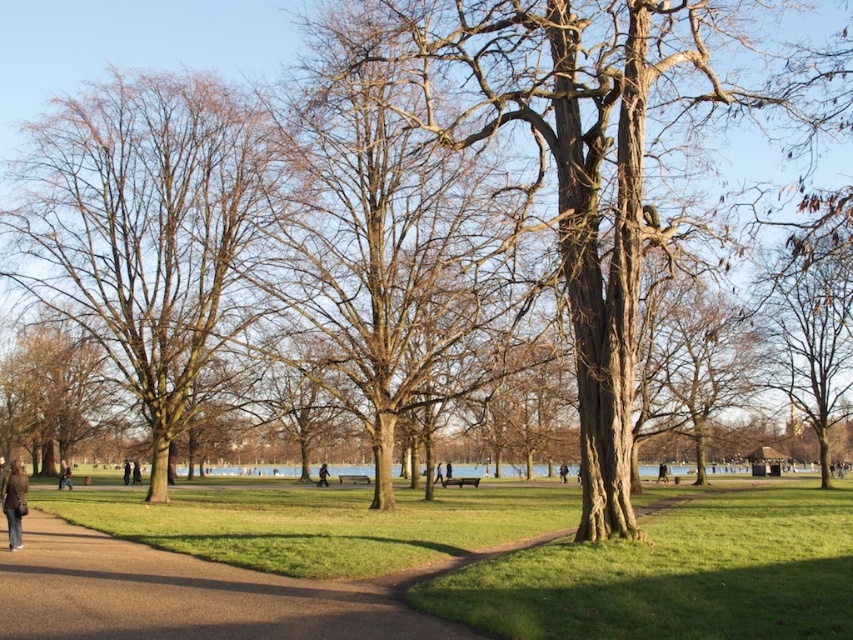
Question: Can you confirm if bare wood tree at left is wider than brown rough tree at left?

Choices:
 (A) no
 (B) yes

Answer: (A)

Question: Among these points, which one is nearest to the camera?

Choices:
 (A) (318, 467)
 (B) (801, 300)

Answer: (B)

Question: Is brown rough bark tree at upper right positioned behind dark brown leather jacket at lower left?

Choices:
 (A) yes
 (B) no

Answer: (B)

Question: Which of the following is the farthest from the observer?

Choices:
 (A) dark brown leather jacket at lower left
 (B) brown rough tree at left

Answer: (A)

Question: Which of the following is the closest to the observer?

Choices:
 (A) brown rough bark tree at upper right
 (B) dark brown leather jacket at lower left

Answer: (A)

Question: Observing the image, what is the correct spatial positioning of brown rough tree at left in reference to dark brown leather jacket at lower left?

Choices:
 (A) below
 (B) above

Answer: (B)